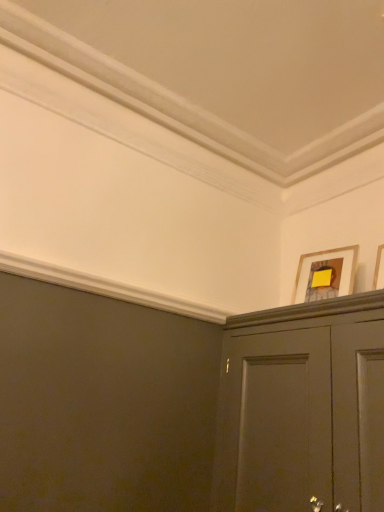
What do you see at coordinates (326, 265) in the screenshot? I see `wooden framed picture at upper right, which ranks as the second picture frame in front-to-back order` at bounding box center [326, 265].

The height and width of the screenshot is (512, 384). In order to click on wooden framed picture at upper right, placed as the 1th picture frame when sorted from back to front in this screenshot , I will do `click(326, 265)`.

Measure the distance between point (381, 285) and camera.

The distance of point (381, 285) from camera is 4.98 feet.

Locate an element on the screen. The height and width of the screenshot is (512, 384). wooden picture frame at upper right, which ranks as the 2th picture frame in back-to-front order is located at coordinates (379, 269).

The width and height of the screenshot is (384, 512). What do you see at coordinates (379, 269) in the screenshot?
I see `wooden picture frame at upper right, the first picture frame positioned from the front` at bounding box center [379, 269].

What are the coordinates of `wooden framed picture at upper right, placed as the 1th picture frame when sorted from back to front` in the screenshot? It's located at (326, 265).

From the picture: Can you confirm if wooden picture frame at upper right, which ranks as the 2th picture frame in back-to-front order, is positioned to the right of wooden framed picture at upper right, which ranks as the second picture frame in front-to-back order?

Yes, wooden picture frame at upper right, which ranks as the 2th picture frame in back-to-front order, is to the right of wooden framed picture at upper right, which ranks as the second picture frame in front-to-back order.

Is wooden picture frame at upper right, the first picture frame positioned from the front, behind wooden framed picture at upper right, which ranks as the second picture frame in front-to-back order?

No, wooden picture frame at upper right, the first picture frame positioned from the front, is closer to the camera.

Which point is more forward, (379, 251) or (297, 291)?

Positioned in front is point (379, 251).

From the image's perspective, which object appears higher, wooden picture frame at upper right, the first picture frame positioned from the front, or wooden framed picture at upper right, which ranks as the second picture frame in front-to-back order?

wooden picture frame at upper right, the first picture frame positioned from the front.

From a real-world perspective, is wooden picture frame at upper right, the first picture frame positioned from the front, on wooden framed picture at upper right, placed as the 1th picture frame when sorted from back to front?

No, from a real-world perspective, wooden picture frame at upper right, the first picture frame positioned from the front, is not on top of wooden framed picture at upper right, placed as the 1th picture frame when sorted from back to front.

Which object is wider, wooden picture frame at upper right, the first picture frame positioned from the front, or wooden framed picture at upper right, placed as the 1th picture frame when sorted from back to front?

wooden framed picture at upper right, placed as the 1th picture frame when sorted from back to front.

Does wooden picture frame at upper right, which ranks as the 2th picture frame in back-to-front order, have a greater height compared to wooden framed picture at upper right, placed as the 1th picture frame when sorted from back to front?

Correct, wooden picture frame at upper right, which ranks as the 2th picture frame in back-to-front order, is much taller as wooden framed picture at upper right, placed as the 1th picture frame when sorted from back to front.

Can you confirm if wooden picture frame at upper right, which ranks as the 2th picture frame in back-to-front order, is bigger than wooden framed picture at upper right, placed as the 1th picture frame when sorted from back to front?

Actually, wooden picture frame at upper right, which ranks as the 2th picture frame in back-to-front order, might be smaller than wooden framed picture at upper right, placed as the 1th picture frame when sorted from back to front.

Do you think wooden picture frame at upper right, the first picture frame positioned from the front, is within wooden framed picture at upper right, placed as the 1th picture frame when sorted from back to front, or outside of it?

wooden picture frame at upper right, the first picture frame positioned from the front, cannot be found inside wooden framed picture at upper right, placed as the 1th picture frame when sorted from back to front.

Would you say wooden picture frame at upper right, the first picture frame positioned from the front, is a long distance from wooden framed picture at upper right, placed as the 1th picture frame when sorted from back to front?

No, wooden picture frame at upper right, the first picture frame positioned from the front, is in close proximity to wooden framed picture at upper right, placed as the 1th picture frame when sorted from back to front.

Is wooden framed picture at upper right, which ranks as the second picture frame in front-to-back order, at the back of wooden picture frame at upper right, the first picture frame positioned from the front?

No, wooden picture frame at upper right, the first picture frame positioned from the front,'s orientation is not away from wooden framed picture at upper right, which ranks as the second picture frame in front-to-back order.

Measure the distance from wooden picture frame at upper right, which ranks as the 2th picture frame in back-to-front order, to wooden framed picture at upper right, placed as the 1th picture frame when sorted from back to front.

wooden picture frame at upper right, which ranks as the 2th picture frame in back-to-front order, and wooden framed picture at upper right, placed as the 1th picture frame when sorted from back to front, are 12.88 inches apart from each other.

Identify the location of picture frame in front of the wooden framed picture at upper right, placed as the 1th picture frame when sorted from back to front. (379, 269).

Between wooden framed picture at upper right, placed as the 1th picture frame when sorted from back to front, and wooden picture frame at upper right, the first picture frame positioned from the front, which one appears on the left side from the viewer's perspective?

wooden framed picture at upper right, placed as the 1th picture frame when sorted from back to front, is more to the left.

Is wooden framed picture at upper right, placed as the 1th picture frame when sorted from back to front, positioned before wooden picture frame at upper right, the first picture frame positioned from the front?

No, wooden framed picture at upper right, placed as the 1th picture frame when sorted from back to front, is behind wooden picture frame at upper right, the first picture frame positioned from the front.

Which is behind, point (351, 269) or point (382, 277)?

The point (351, 269) is farther.

From the image's perspective, between wooden framed picture at upper right, placed as the 1th picture frame when sorted from back to front, and wooden picture frame at upper right, which ranks as the 2th picture frame in back-to-front order, which one is located above?

wooden picture frame at upper right, which ranks as the 2th picture frame in back-to-front order, is shown above in the image.

From a real-world perspective, is wooden framed picture at upper right, placed as the 1th picture frame when sorted from back to front, positioned under wooden picture frame at upper right, which ranks as the 2th picture frame in back-to-front order, based on gravity?

No, from a real-world perspective, wooden framed picture at upper right, placed as the 1th picture frame when sorted from back to front, is not beneath wooden picture frame at upper right, which ranks as the 2th picture frame in back-to-front order.

Which of these two, wooden framed picture at upper right, placed as the 1th picture frame when sorted from back to front, or wooden picture frame at upper right, which ranks as the 2th picture frame in back-to-front order, is wider?

wooden framed picture at upper right, placed as the 1th picture frame when sorted from back to front.

Considering the relative sizes of wooden framed picture at upper right, which ranks as the second picture frame in front-to-back order, and wooden picture frame at upper right, the first picture frame positioned from the front, in the image provided, is wooden framed picture at upper right, which ranks as the second picture frame in front-to-back order, taller than wooden picture frame at upper right, the first picture frame positioned from the front,?

In fact, wooden framed picture at upper right, which ranks as the second picture frame in front-to-back order, may be shorter than wooden picture frame at upper right, the first picture frame positioned from the front.

Between wooden framed picture at upper right, which ranks as the second picture frame in front-to-back order, and wooden picture frame at upper right, which ranks as the 2th picture frame in back-to-front order, which one has larger size?

Bigger between the two is wooden framed picture at upper right, which ranks as the second picture frame in front-to-back order.

Is wooden framed picture at upper right, which ranks as the second picture frame in front-to-back order, outside of wooden picture frame at upper right, the first picture frame positioned from the front?

Yes, wooden framed picture at upper right, which ranks as the second picture frame in front-to-back order, is not within wooden picture frame at upper right, the first picture frame positioned from the front.

In the scene shown: Can you see wooden framed picture at upper right, which ranks as the second picture frame in front-to-back order, touching wooden picture frame at upper right, the first picture frame positioned from the front?

No, wooden framed picture at upper right, which ranks as the second picture frame in front-to-back order, is not making contact with wooden picture frame at upper right, the first picture frame positioned from the front.

Is wooden framed picture at upper right, placed as the 1th picture frame when sorted from back to front, turned away from wooden picture frame at upper right, which ranks as the 2th picture frame in back-to-front order?

No.

What's the angular difference between wooden framed picture at upper right, which ranks as the second picture frame in front-to-back order, and wooden picture frame at upper right, the first picture frame positioned from the front,'s facing directions?

wooden framed picture at upper right, which ranks as the second picture frame in front-to-back order, and wooden picture frame at upper right, the first picture frame positioned from the front, are facing 15.5 degrees away from each other.

Measure the distance between wooden framed picture at upper right, placed as the 1th picture frame when sorted from back to front, and wooden picture frame at upper right, the first picture frame positioned from the front.

They are 12.88 inches apart.

The width and height of the screenshot is (384, 512). I want to click on picture frame lying above the wooden framed picture at upper right, placed as the 1th picture frame when sorted from back to front (from the image's perspective), so click(x=379, y=269).

In the image, there is a wooden framed picture at upper right, placed as the 1th picture frame when sorted from back to front. Where is `picture frame above it (from the image's perspective)`? The height and width of the screenshot is (512, 384). picture frame above it (from the image's perspective) is located at coordinates (379, 269).

The height and width of the screenshot is (512, 384). What are the coordinates of `picture frame behind the wooden picture frame at upper right, which ranks as the 2th picture frame in back-to-front order` in the screenshot? It's located at (326, 265).